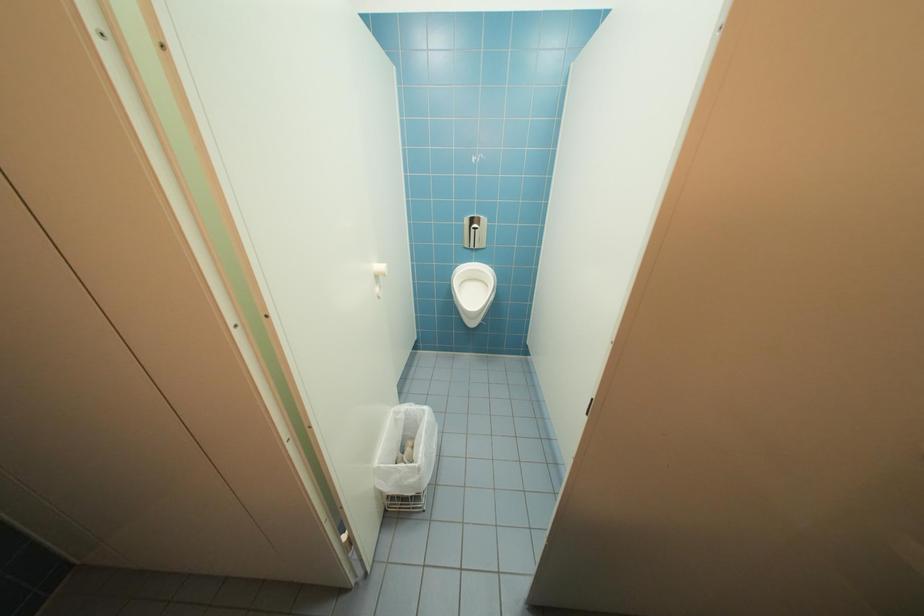
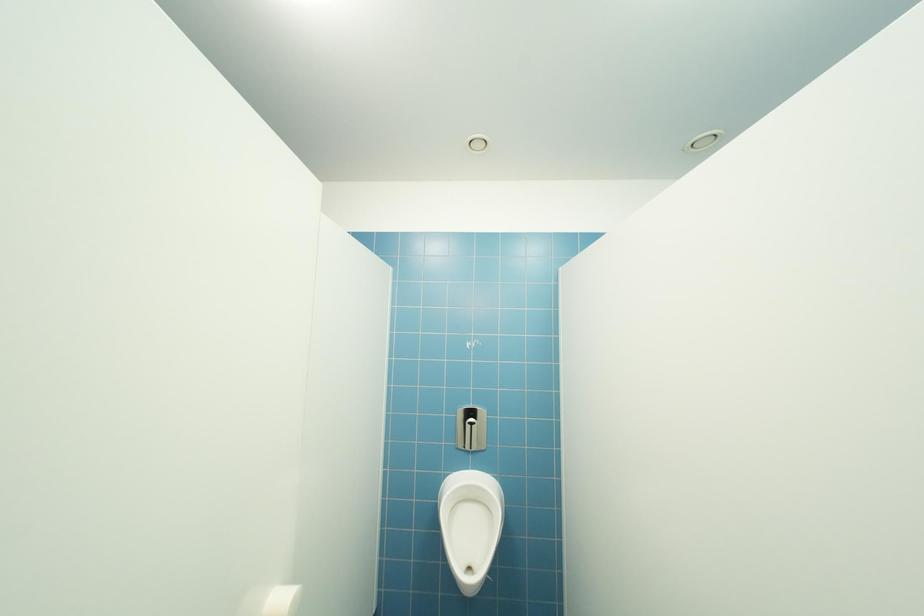
Question: The first image is from the beginning of the video and the second image is from the end. How did the camera likely rotate when shooting the video?

Choices:
 (A) Left
 (B) Right
 (C) Up
 (D) Down

Answer: (C)